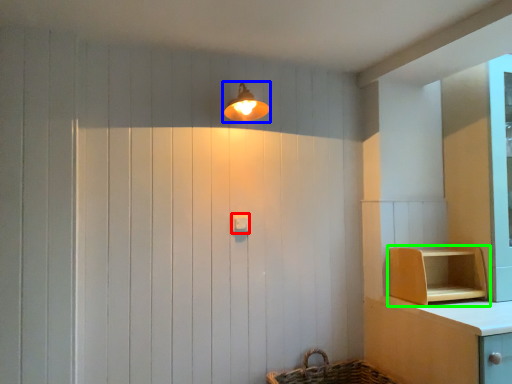
Question: Which is farther away from light switch (highlighted by a red box)? light fixture (highlighted by a blue box) or shelf (highlighted by a green box)?

Choices:
 (A) light fixture
 (B) shelf

Answer: (B)